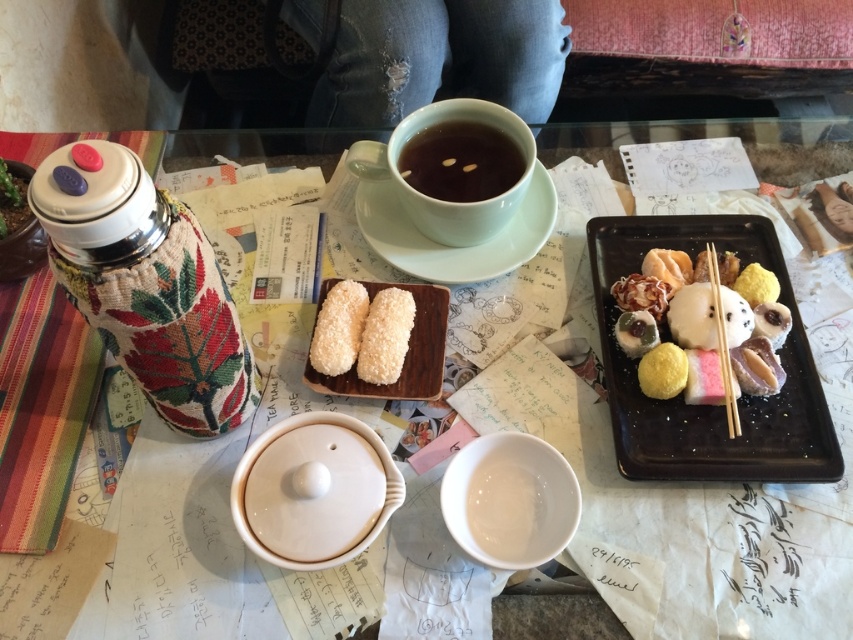
You are a customer at this table and want to reach for the slightly translucent brown meat at center without moving the brown matte cup at upper center. Is this possible?

The brown matte cup at upper center is located above slightly translucent brown meat at center, so you cannot reach the meat without moving the cup.

You are a customer sitting at the table and want to reach for either the brown matte cup at upper center or the slightly translucent brown meat at center. Which item will be easier to grab without moving your hand too much?

The brown matte cup at upper center is easier to grab because it is closer to you than the slightly translucent brown meat at center.